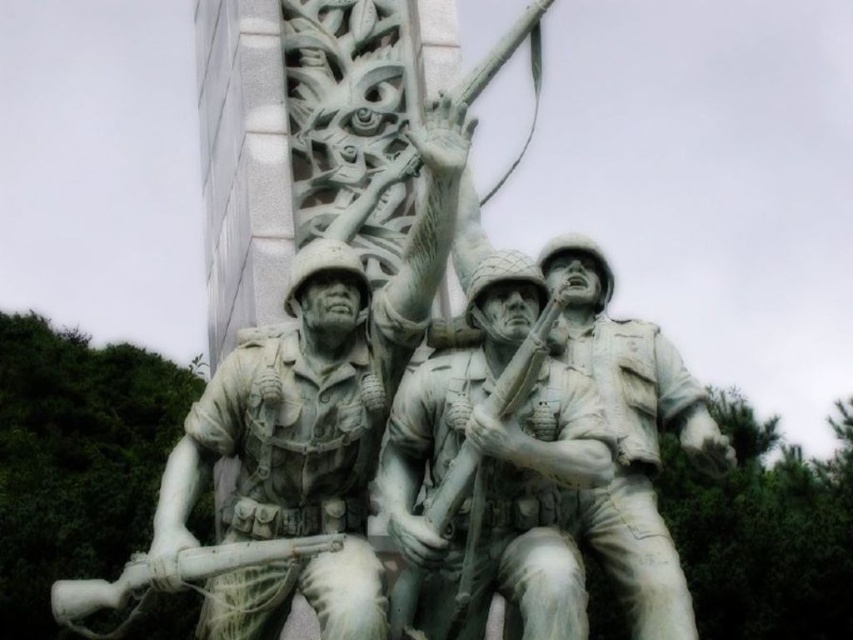
Question: Can you confirm if white marble statue at center is thinner than gray stone soldier at center?

Choices:
 (A) no
 (B) yes

Answer: (A)

Question: Which point is farther to the camera?

Choices:
 (A) gray stone soldier at center
 (B) white matte rifle at lower left
 (C) white stone soldier at center

Answer: (C)

Question: Considering the relative positions of white marble statue at center and white matte rifle at lower left in the image provided, where is white marble statue at center located with respect to white matte rifle at lower left?

Choices:
 (A) right
 (B) left

Answer: (A)

Question: Where is white marble statue at center located in relation to white stone soldier at center in the image?

Choices:
 (A) left
 (B) right

Answer: (A)

Question: Which of the following is the closest to the observer?

Choices:
 (A) white marble statue at center
 (B) white matte rifle at lower left
 (C) white stone soldier at center
 (D) gray stone soldier at center

Answer: (A)

Question: Which object appears farthest from the camera in this image?

Choices:
 (A) white matte rifle at lower left
 (B) gray stone soldier at center
 (C) white marble statue at center
 (D) white stone soldier at center

Answer: (D)